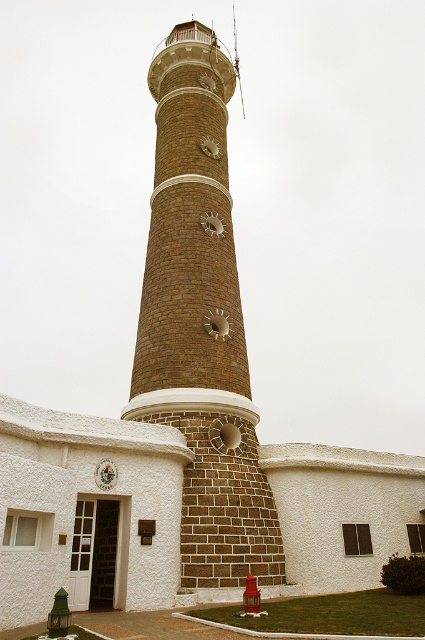
In the scene shown: You are standing in front of the lighthouse complex and need to locate the red matte hydrant at lower center. According to the scene, which direction should you turn to face the hydrant from the brown brick tower at center?

The brown brick tower at center is to the left of the red matte hydrant at lower center, so you should turn to your right to face the hydrant from the tower.

Based on the photo, you are a visitor standing at the entrance of the lighthouse complex. You see the brown brick tower at center and the red matte hydrant at lower center. Which object is taller?

The brown brick tower at center is taller than the red matte hydrant at lower center.

In the scene shown: You are a visitor approaching the lighthouse and notice the brown brick tower at center and the red matte hydrant at lower center. Which object is closer to you as you approach the lighthouse?

The red matte hydrant at lower center is behind the brown brick tower at center, so the brown brick tower at center is closer to you as you approach the lighthouse.